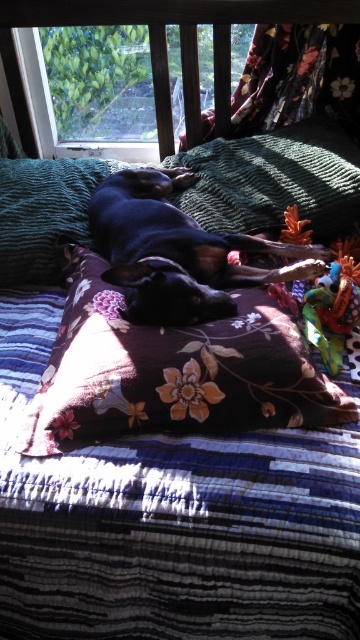
Between fluffy teal blanket at upper center and clear glass window at upper center, which one has more height?

Standing taller between the two is fluffy teal blanket at upper center.

Who is shorter, fluffy teal blanket at upper center or clear glass window at upper center?

clear glass window at upper center

Measure the distance between point [258,221] and camera.

1.39 meters

Where is `fluffy teal blanket at upper center`? The width and height of the screenshot is (360, 640). fluffy teal blanket at upper center is located at coordinates (273, 180).

Does floral fabric pillow at center lie in front of fluffy teal blanket at upper center?

Yes, floral fabric pillow at center is closer to the viewer.

Is point (226, 419) more distant than point (312, 204)?

No, it is not.

The width and height of the screenshot is (360, 640). In order to click on floral fabric pillow at center in this screenshot , I will do `click(172, 371)`.

Can you confirm if floral fabric pillow at center is taller than clear glass window at upper center?

Indeed, floral fabric pillow at center has a greater height compared to clear glass window at upper center.

Between point (140, 339) and point (41, 56), which one is positioned behind?

Point (41, 56)

The image size is (360, 640). Find the location of `floral fabric pillow at center`. floral fabric pillow at center is located at coordinates (172, 371).